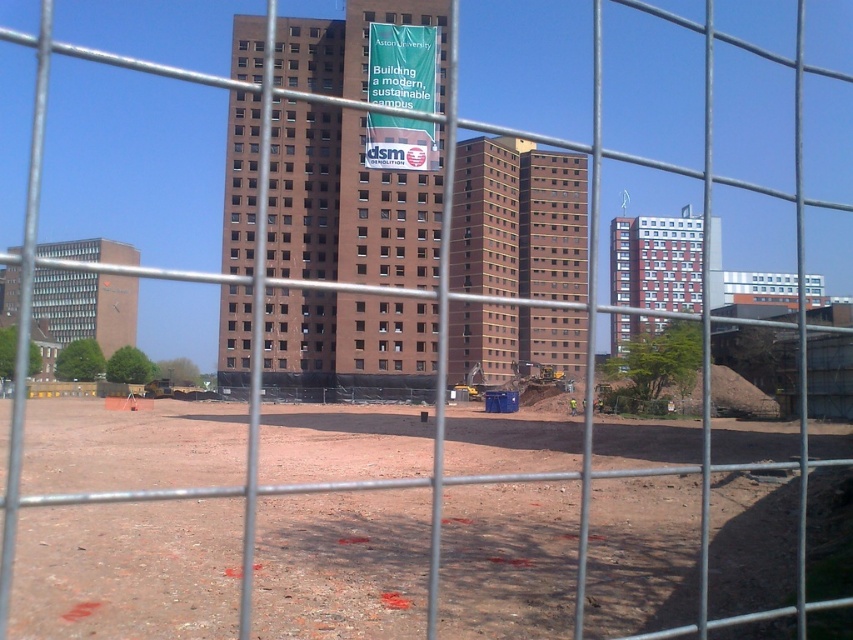
Question: Can you confirm if brown dirt field at center is positioned below green fabric banner at center?

Choices:
 (A) no
 (B) yes

Answer: (B)

Question: Can you confirm if brown dirt field at center is positioned to the left of green fabric banner at center?

Choices:
 (A) yes
 (B) no

Answer: (B)

Question: Can you confirm if brown dirt field at center is positioned above green fabric banner at center?

Choices:
 (A) no
 (B) yes

Answer: (A)

Question: Which point is closer to the camera?

Choices:
 (A) (378, 147)
 (B) (665, 502)

Answer: (B)